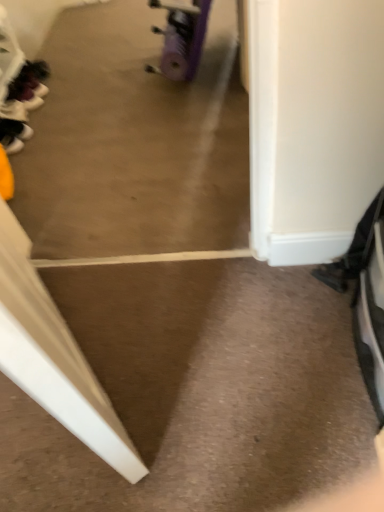
Question: From the image's perspective, is black matte shoe at left, the 2th footwear positioned from the back, located above or below matte black shoe at left, the first footwear viewed from the top?

Choices:
 (A) above
 (B) below

Answer: (B)

Question: Considering the positions of point pyautogui.click(x=11, y=137) and point pyautogui.click(x=23, y=114), is point pyautogui.click(x=11, y=137) closer or farther from the camera than point pyautogui.click(x=23, y=114)?

Choices:
 (A) farther
 (B) closer

Answer: (B)

Question: Which object is positioned farthest from the purple rubber wheel at center?

Choices:
 (A) matte black shoe at left, which appears as the second footwear when ordered from the bottom
 (B) black matte shoe at left, placed as the first footwear when sorted from front to back

Answer: (A)

Question: Estimate the real-world distances between objects in this image. Which object is farther from the black matte shoe at left, the 2th footwear positioned from the back?

Choices:
 (A) purple rubber wheel at center
 (B) matte black shoe at left, the first footwear when ordered from back to front

Answer: (A)